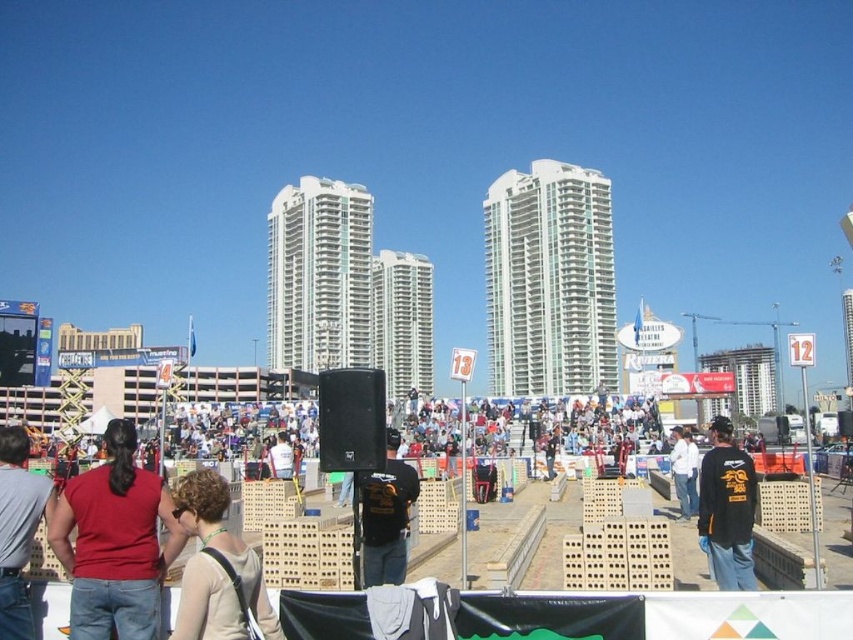
Question: Does light beige fabric at center come in front of black matte shirt at center?

Choices:
 (A) no
 (B) yes

Answer: (B)

Question: From the image, what is the correct spatial relationship of matte red shirt at left in relation to black t-shirt at center?

Choices:
 (A) above
 (B) below

Answer: (B)

Question: Which object is farther from the camera taking this photo?

Choices:
 (A) matte red shirt at left
 (B) black t-shirt at center
 (C) white cotton shirt at center
 (D) light beige fabric at center

Answer: (C)

Question: Which object appears closest to the camera in this image?

Choices:
 (A) matte black shirt at center
 (B) black t-shirt at center
 (C) matte red shirt at lower left
 (D) light beige fabric at center

Answer: (D)

Question: Which point is closer to the camera taking this photo?

Choices:
 (A) (221, 598)
 (B) (183, 540)
 (C) (22, 580)
 (D) (734, 541)

Answer: (A)

Question: Is matte red shirt at lower left smaller than matte black shirt at center?

Choices:
 (A) no
 (B) yes

Answer: (A)